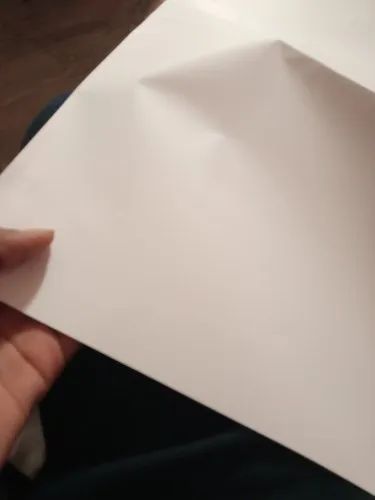
This screenshot has width=375, height=500. Identify the location of sheet of paper. (266, 374).